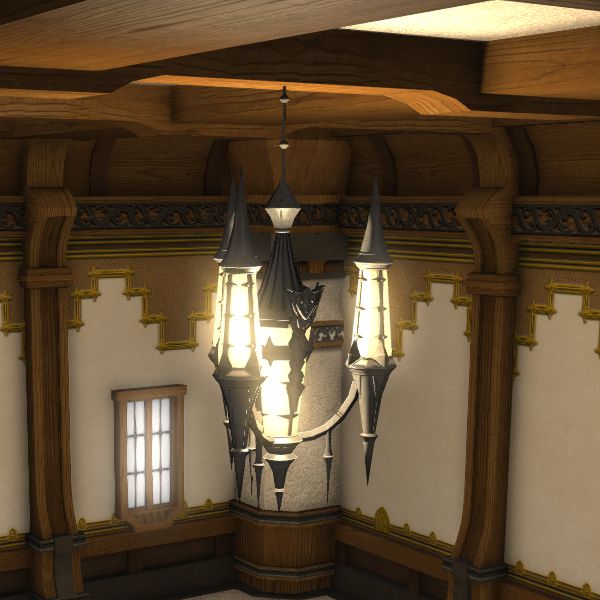
Image resolution: width=600 pixels, height=600 pixels. I want to click on light, so click(235, 319), click(280, 379), click(375, 303), click(286, 217).